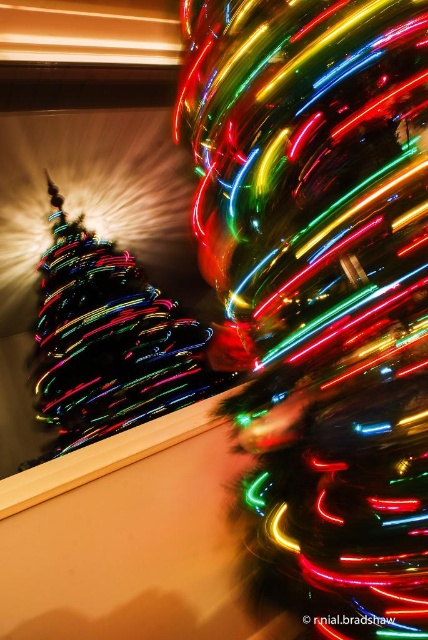
Looking at this image, is multicolored neon lights at center below multicolored lights at left?

Yes, multicolored neon lights at center is below multicolored lights at left.

Identify the location of multicolored neon lights at center. The image size is (428, 640). (321, 291).

Where is `multicolored neon lights at center`? This screenshot has height=640, width=428. multicolored neon lights at center is located at coordinates (321, 291).